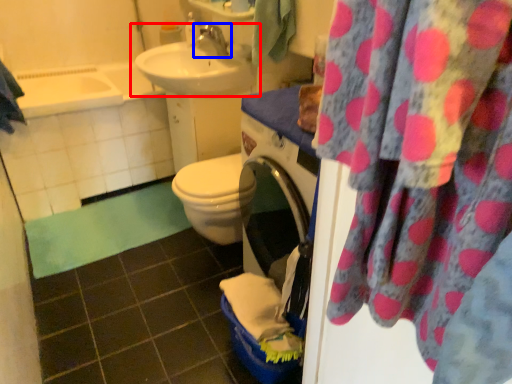
Question: Which object is further to the camera taking this photo, sink (highlighted by a red box) or tap (highlighted by a blue box)?

Choices:
 (A) sink
 (B) tap

Answer: (B)